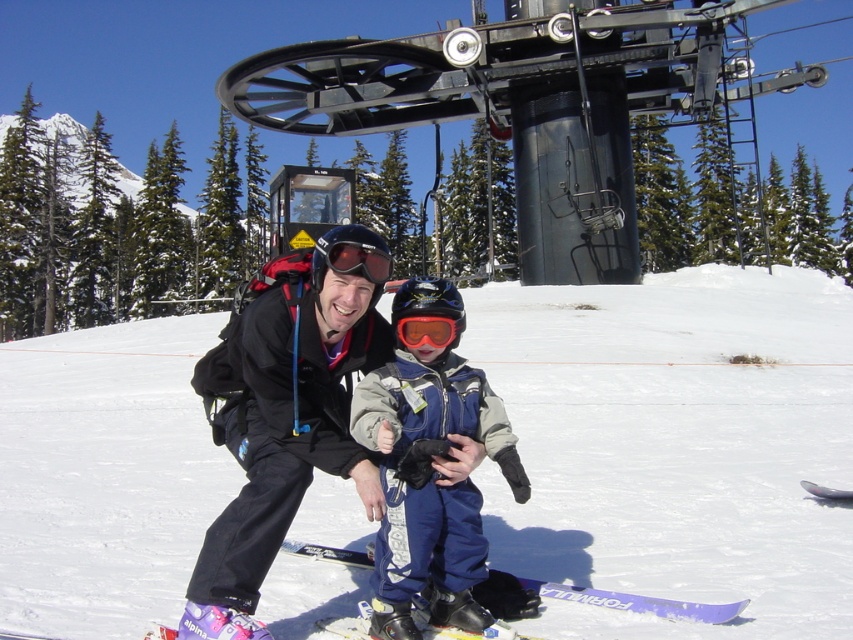
Question: Which object is the closest to the blue fleece snowsuit at center?

Choices:
 (A) matte black jacket at center
 (B) white powder snow at center
 (C) black matte goggles at center
 (D) orange reflective goggles at center

Answer: (D)

Question: Is the position of black matte goggles at center more distant than that of orange reflective goggles at center?

Choices:
 (A) no
 (B) yes

Answer: (A)

Question: Does white powder snow at center have a larger size compared to matte black jacket at center?

Choices:
 (A) yes
 (B) no

Answer: (A)

Question: Which of the following is the farthest from the observer?

Choices:
 (A) black matte goggles at center
 (B) orange reflective goggles at center

Answer: (B)

Question: Which object appears farthest from the camera in this image?

Choices:
 (A) blue fleece snowsuit at center
 (B) blue plastic ski at lower center

Answer: (B)

Question: Can you confirm if white powder snow at center is smaller than orange reflective goggles at center?

Choices:
 (A) yes
 (B) no

Answer: (B)